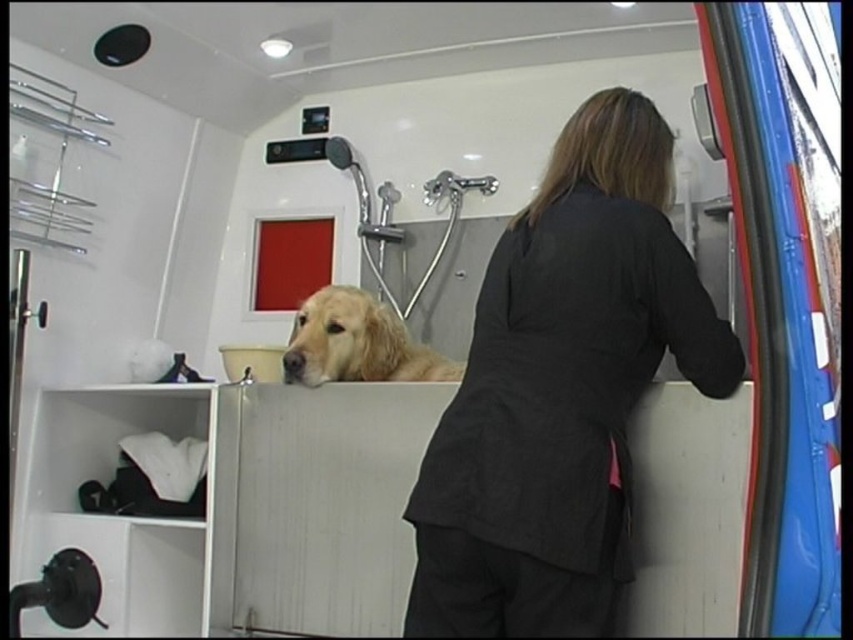
Question: Can you confirm if dark gray fabric coat at center is wider than golden fur dog at center?

Choices:
 (A) yes
 (B) no

Answer: (A)

Question: Does dark gray fabric coat at center appear on the left side of golden fur dog at center?

Choices:
 (A) yes
 (B) no

Answer: (B)

Question: Which point appears closest to the camera in this image?

Choices:
 (A) (634, 387)
 (B) (300, 346)

Answer: (A)

Question: Is dark gray fabric coat at center to the left of golden fur dog at center from the viewer's perspective?

Choices:
 (A) no
 (B) yes

Answer: (A)

Question: Which of the following is the farthest from the observer?

Choices:
 (A) golden fur dog at center
 (B) dark gray fabric coat at center

Answer: (A)